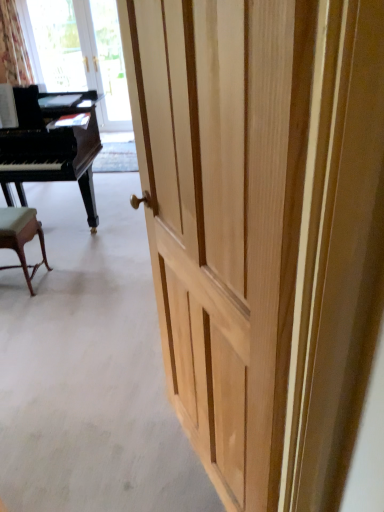
Question: Is black polished piano at left shorter than transparent glass door at upper left?

Choices:
 (A) yes
 (B) no

Answer: (A)

Question: Is black polished piano at left turned away from transparent glass door at upper left?

Choices:
 (A) yes
 (B) no

Answer: (A)

Question: Does black polished piano at left have a greater height compared to transparent glass door at upper left?

Choices:
 (A) yes
 (B) no

Answer: (B)

Question: Is black polished piano at left positioned far away from transparent glass door at upper left?

Choices:
 (A) yes
 (B) no

Answer: (A)

Question: Is black polished piano at left at the left side of transparent glass door at upper left?

Choices:
 (A) no
 (B) yes

Answer: (B)

Question: Would you say black polished piano at left is inside or outside transparent glass door at upper left?

Choices:
 (A) outside
 (B) inside

Answer: (A)

Question: Looking at their shapes, would you say black polished piano at left is wider or thinner than transparent glass door at upper left?

Choices:
 (A) thin
 (B) wide

Answer: (B)

Question: Considering the positions of point (19, 160) and point (97, 9), is point (19, 160) closer or farther from the camera than point (97, 9)?

Choices:
 (A) closer
 (B) farther

Answer: (A)

Question: Considering the relative positions of black polished piano at left and transparent glass door at upper left in the image provided, is black polished piano at left to the left or to the right of transparent glass door at upper left?

Choices:
 (A) right
 (B) left

Answer: (B)

Question: Is point (41, 159) closer or farther from the camera than point (41, 55)?

Choices:
 (A) closer
 (B) farther

Answer: (A)

Question: From the image's perspective, is black polished piano at left above or below transparent glass window screen at upper left?

Choices:
 (A) above
 (B) below

Answer: (B)

Question: In the image, is black polished piano at left on the left side or the right side of transparent glass window screen at upper left?

Choices:
 (A) right
 (B) left

Answer: (A)

Question: In terms of width, does black polished piano at left look wider or thinner when compared to transparent glass window screen at upper left?

Choices:
 (A) wide
 (B) thin

Answer: (A)

Question: Relative to transparent glass window screen at upper left, is green fabric stool at lower left in front or behind?

Choices:
 (A) behind
 (B) front

Answer: (B)

Question: From the image's perspective, is green fabric stool at lower left located above or below transparent glass window screen at upper left?

Choices:
 (A) above
 (B) below

Answer: (B)